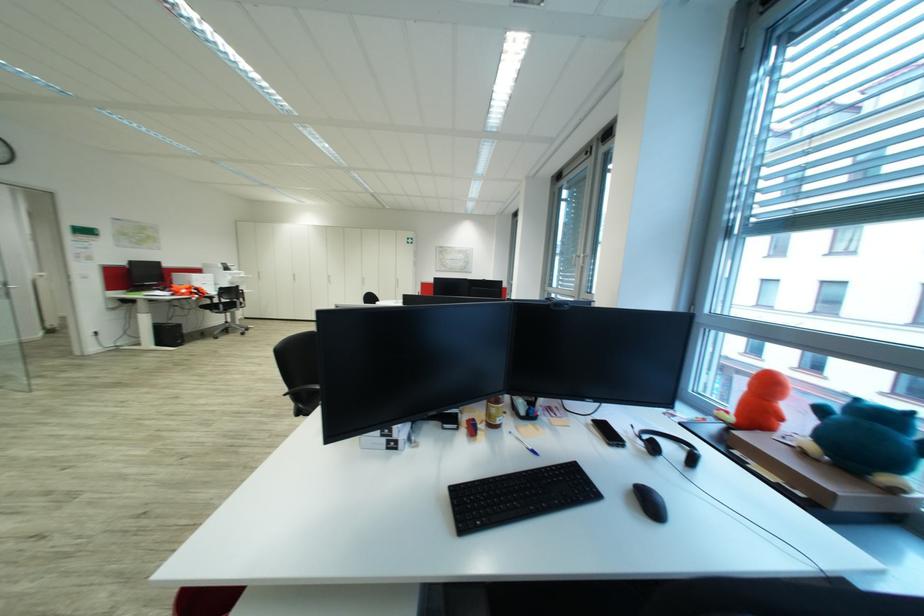
Locate an element on the screen. This screenshot has width=924, height=616. brown drink bottle is located at coordinates (493, 411).